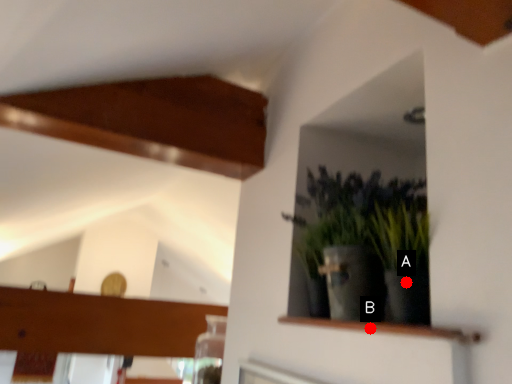
Question: Two points are circled on the image, labeled by A and B beside each circle. Which point appears closest to the camera in this image?

Choices:
 (A) A is closer
 (B) B is closer

Answer: (A)